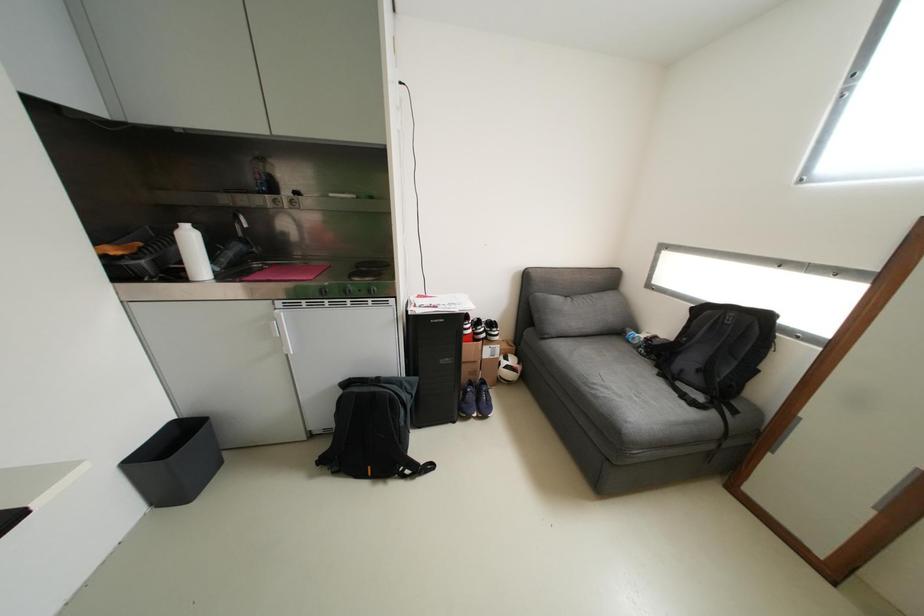
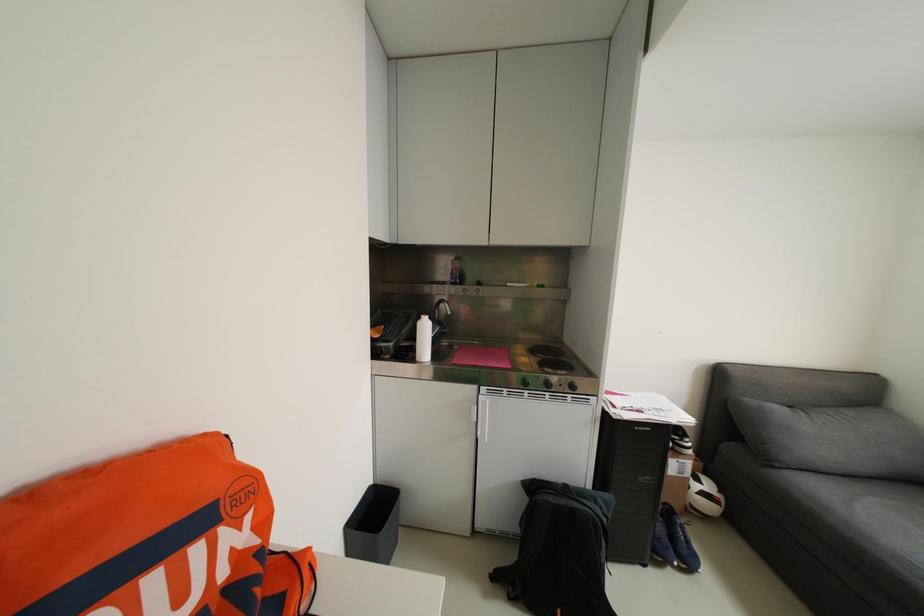
Question: The images are taken continuously from a first-person perspective. In which direction is your viewpoint rotating?

Choices:
 (A) Left
 (B) Right
 (C) Up
 (D) Down

Answer: (A)